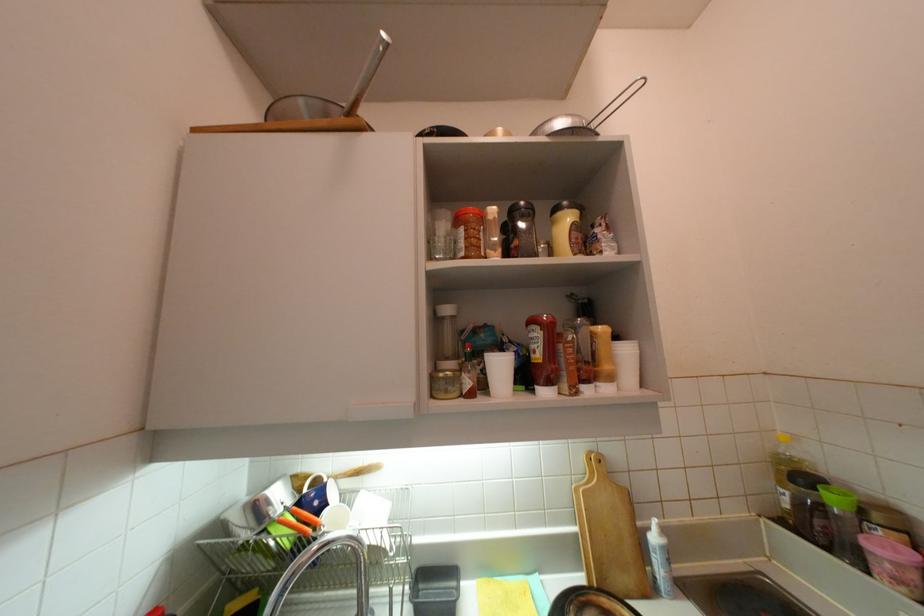
You are a GUI agent. You are given a task and a screenshot of the screen. Output one action in this format:
    pyautogui.click(x=<x>, y=<y>)
    Task: Click on the pan handle
    
    Given the screenshot: What is the action you would take?
    pyautogui.click(x=368, y=73)